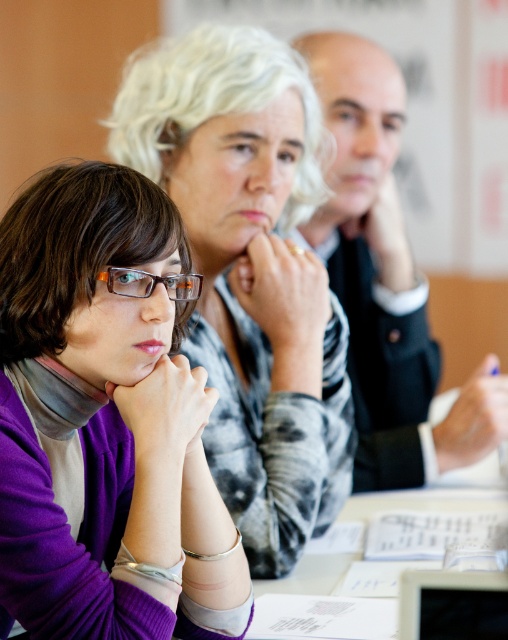
Does smooth black suit at center appear over black glossy tablet at lower right?

Yes.

Does smooth black suit at center have a larger size compared to black glossy tablet at lower right?

Indeed, smooth black suit at center has a larger size compared to black glossy tablet at lower right.

Who is more forward, (389, 412) or (495, 620)?

Point (495, 620)

Where is `smooth black suit at center`? smooth black suit at center is located at coordinates (x=386, y=280).

Is matte gray sweater at center behind smooth black suit at center?

No, it is not.

Who is higher up, matte gray sweater at center or smooth black suit at center?

smooth black suit at center is higher up.

This screenshot has width=508, height=640. I want to click on matte gray sweater at center, so click(249, 273).

Is purple matte sweater at center behind smooth black suit at center?

No, purple matte sweater at center is closer to the viewer.

Does purple matte sweater at center have a lesser width compared to smooth black suit at center?

Yes, purple matte sweater at center is thinner than smooth black suit at center.

Which is behind, point (37, 486) or point (387, 134)?

The point (387, 134) is behind.

Where is `purple matte sweater at center`? purple matte sweater at center is located at coordinates tap(106, 420).